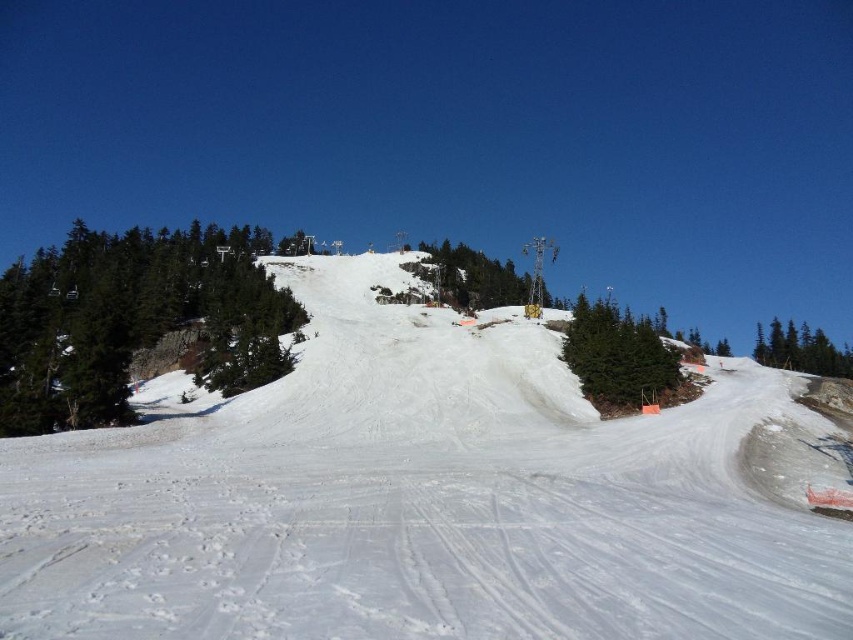
Between green matte tree at center and yellow metallic tower at center, which one has more height?

Standing taller between the two is yellow metallic tower at center.

You are a GUI agent. You are given a task and a screenshot of the screen. Output one action in this format:
    pyautogui.click(x=<x>, y=<y>)
    Task: Click on the green matte tree at center
    The height and width of the screenshot is (640, 853).
    Given the screenshot: What is the action you would take?
    pyautogui.click(x=618, y=356)

The image size is (853, 640). I want to click on green matte tree at center, so click(x=618, y=356).

Where is `green matte tree at center`? green matte tree at center is located at coordinates (618, 356).

Is white powdery snow at center bigger than green matte tree at center?

Yes.

Which is below, white powdery snow at center or green matte tree at center?

white powdery snow at center

Is point (126, 515) farther from camera compared to point (659, 339)?

No, (126, 515) is closer to viewer.

The image size is (853, 640). Identify the location of white powdery snow at center. (426, 497).

Does green matte tree at center appear on the left side of green matte tree at right?

Yes, green matte tree at center is to the left of green matte tree at right.

Describe the element at coordinates (618, 356) in the screenshot. I see `green matte tree at center` at that location.

Where is `green matte tree at center`? green matte tree at center is located at coordinates (618, 356).